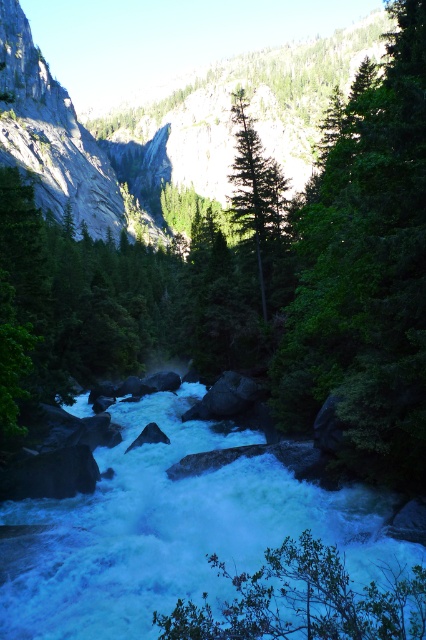
Which of these two, white frothy water at center or green matte tree at center, stands shorter?

Standing shorter between the two is white frothy water at center.

Is white frothy water at center to the right of green matte tree at center from the viewer's perspective?

Incorrect, white frothy water at center is not on the right side of green matte tree at center.

The image size is (426, 640). What do you see at coordinates (172, 531) in the screenshot?
I see `white frothy water at center` at bounding box center [172, 531].

What are the coordinates of `white frothy water at center` in the screenshot? It's located at (172, 531).

Is point (81, 625) positioned behind point (330, 340)?

That is False.

Does white frothy water at center have a greater width compared to green leafy tree at center?

Yes, white frothy water at center is wider than green leafy tree at center.

Image resolution: width=426 pixels, height=640 pixels. What do you see at coordinates (172, 531) in the screenshot? I see `white frothy water at center` at bounding box center [172, 531].

You are a GUI agent. You are given a task and a screenshot of the screen. Output one action in this format:
    pyautogui.click(x=<x>, y=<y>)
    Task: Click on the white frothy water at center
    The width and height of the screenshot is (426, 640).
    Given the screenshot: What is the action you would take?
    pyautogui.click(x=172, y=531)

Does white frothy water at center have a larger size compared to green leafy tree at lower center?

Indeed, white frothy water at center has a larger size compared to green leafy tree at lower center.

This screenshot has height=640, width=426. In order to click on white frothy water at center in this screenshot , I will do (172, 531).